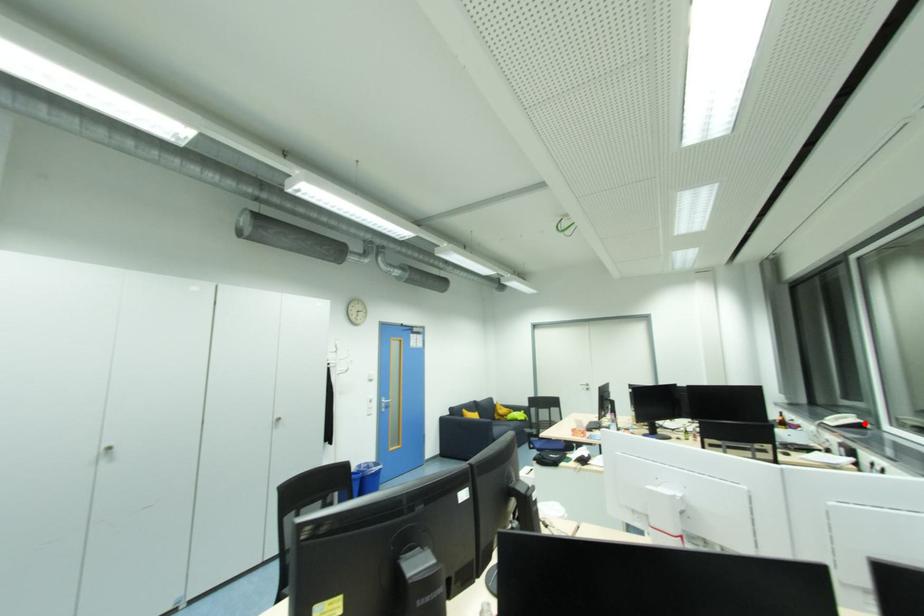
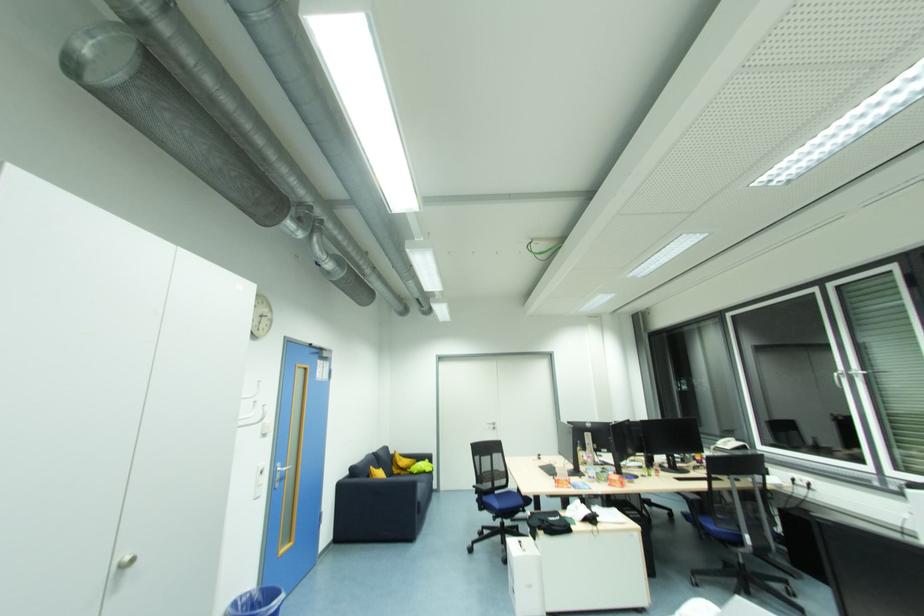
In the second image, find the point that corresponds to the highlighted location in the first image.

(745, 446)